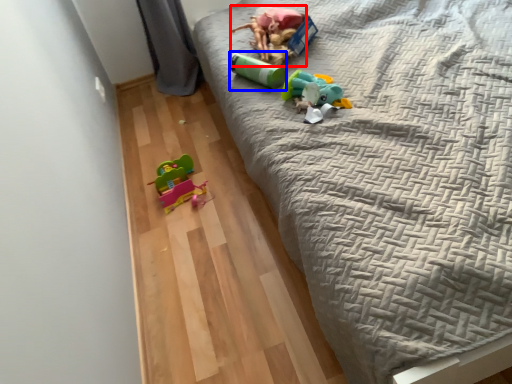
Question: Which object appears closest to the camera in this image, toy (highlighted by a red box) or toy (highlighted by a blue box)?

Choices:
 (A) toy
 (B) toy

Answer: (B)